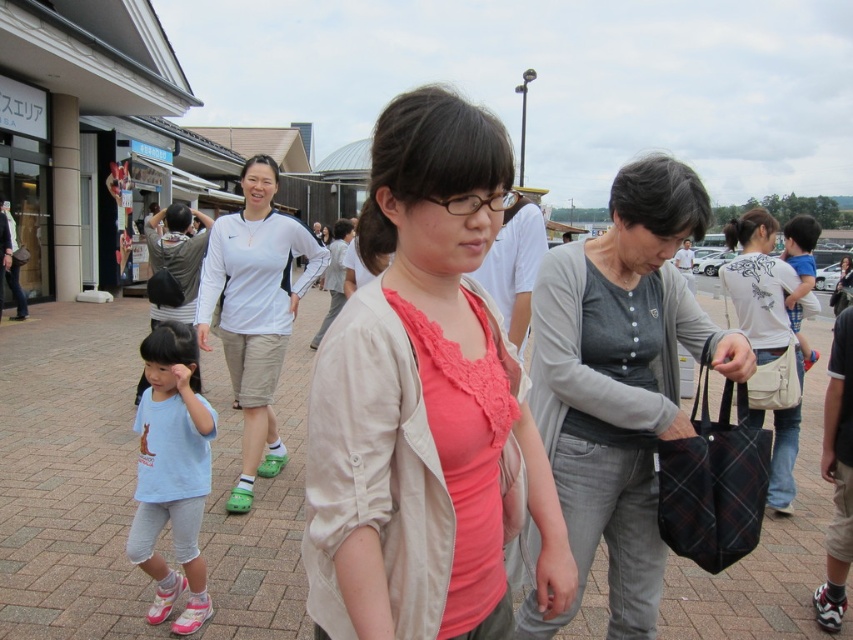
Does pink fabric shirt at center appear under white fabric shirt at center?

Yes.

Is pink fabric shirt at center above white fabric shirt at center?

No.

Between point (389, 198) and point (308, 266), which one is positioned in front?

Point (389, 198)

The width and height of the screenshot is (853, 640). Identify the location of pink fabric shirt at center. (425, 403).

Does brick pavement at center appear under matte white shirt at center?

Correct, brick pavement at center is located below matte white shirt at center.

Does brick pavement at center appear on the left side of matte white shirt at center?

In fact, brick pavement at center is to the right of matte white shirt at center.

At what (x,y) coordinates should I click in order to perform the action: click on brick pavement at center. Please return your answer as a coordinate pair (x, y). This screenshot has width=853, height=640. Looking at the image, I should click on (68, 474).

Can you confirm if white fabric shirt at center is wider than matte white shirt at center?

Yes, white fabric shirt at center is wider than matte white shirt at center.

Is point (234, 241) positioned after point (183, 294)?

No, it is not.

Where is `white fabric shirt at center`? white fabric shirt at center is located at coordinates (254, 310).